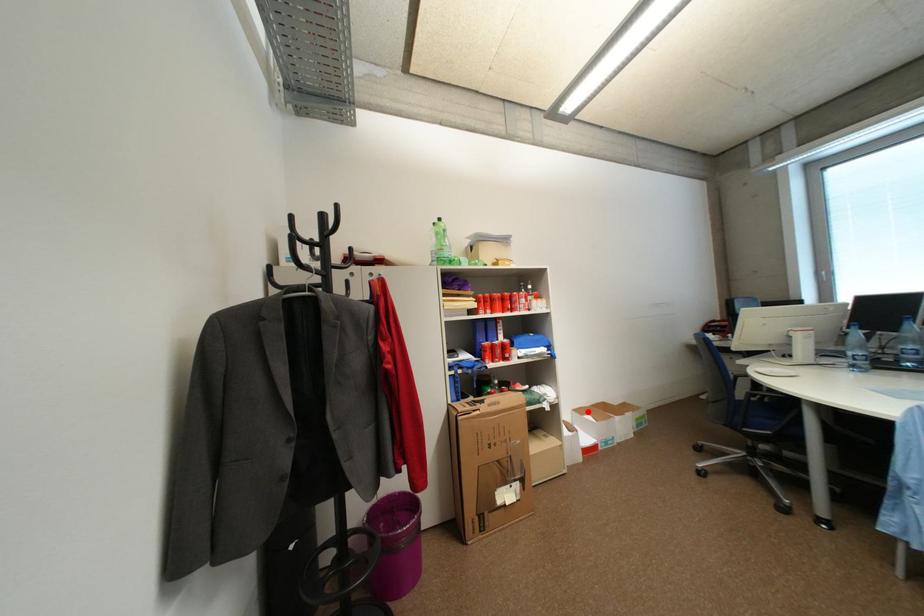
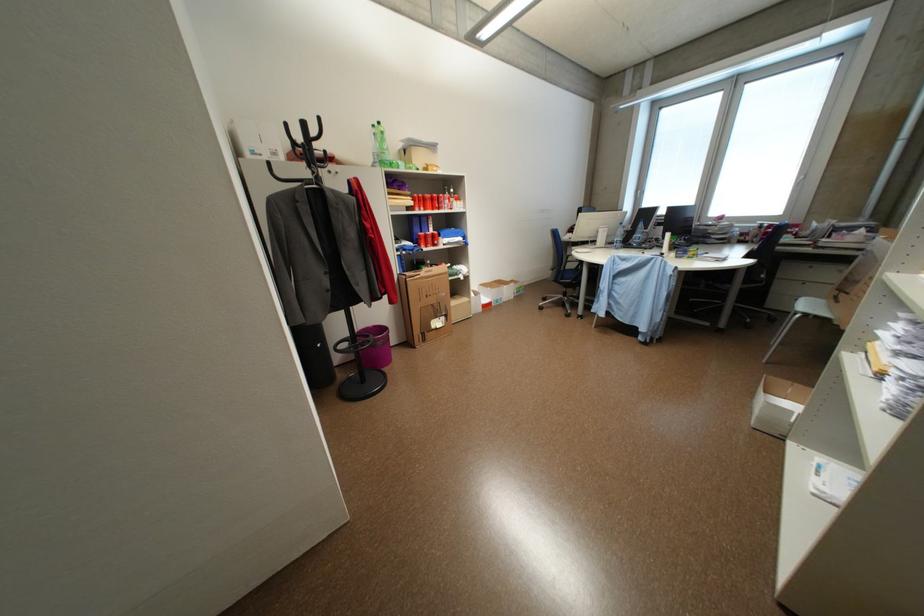
Locate, in the second image, the point that corresponds to the highlighted location in the first image.

(492, 286)